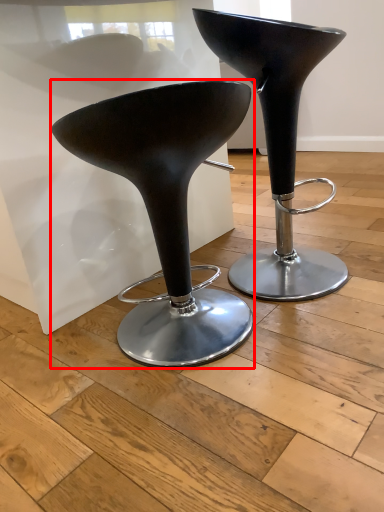
Question: Where is stool (annotated by the red box) located in relation to stool in the image?

Choices:
 (A) left
 (B) right

Answer: (A)